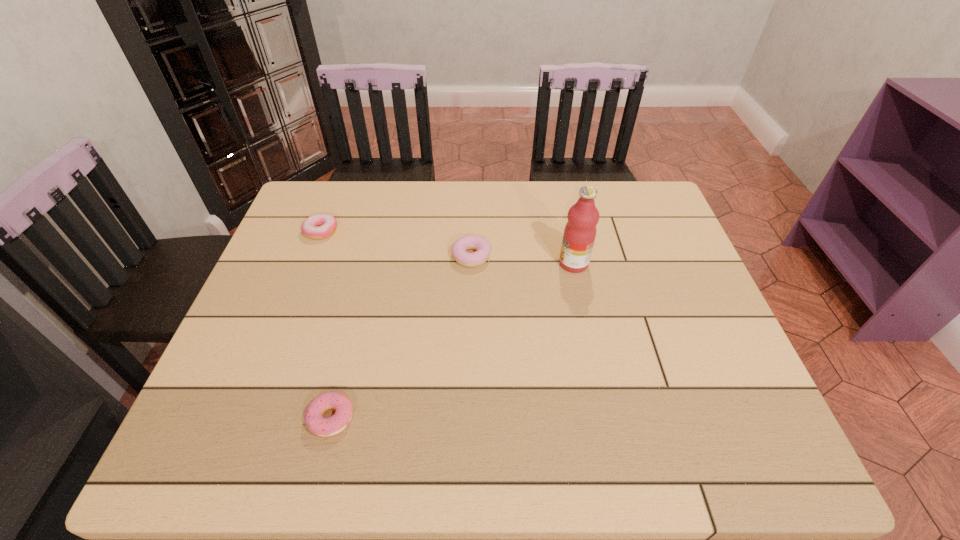
The height and width of the screenshot is (540, 960). I want to click on vacant area between the farthest doughnut and the rightmost object, so click(x=447, y=247).

Find the location of a particular element. vacant space that's between the second doughnut from right to left and the leftmost doughnut is located at coordinates (326, 325).

At what (x,y) coordinates should I click in order to perform the action: click on vacant space in between the farthest object and the third object from left to right. Please return your answer as a coordinate pair (x, y). The image size is (960, 540). Looking at the image, I should click on (396, 244).

I want to click on empty space between the second object from right to left and the tallest object, so click(x=522, y=260).

Identify the location of vacant area between the farthest object and the second doughnut from right to left. (326, 325).

I want to click on object that stands as the second closest to the third object from left to right, so click(x=318, y=226).

You are a GUI agent. You are given a task and a screenshot of the screen. Output one action in this format:
    pyautogui.click(x=<x>, y=<y>)
    Task: Click on the object that is the nearest to the leftmost doughnut
    
    Given the screenshot: What is the action you would take?
    pyautogui.click(x=477, y=258)

Locate which doughnut ranks second in proximity to the second farthest doughnut. Please provide its 2D coordinates. Your answer should be formatted as a tuple, i.e. [(x, y)], where the tuple contains the x and y coordinates of a point satisfying the conditions above.

[(324, 427)]

Select which doughnut appears as the closest to the second doughnut from right to left. Please provide its 2D coordinates. Your answer should be formatted as a tuple, i.e. [(x, y)], where the tuple contains the x and y coordinates of a point satisfying the conditions above.

[(477, 258)]

Where is `vacant point that satisfies the following two spatial constraints: 1. on the front side of the farthest object; 2. on the left side of the second doughnut from left to right`? The image size is (960, 540). vacant point that satisfies the following two spatial constraints: 1. on the front side of the farthest object; 2. on the left side of the second doughnut from left to right is located at coordinates (249, 418).